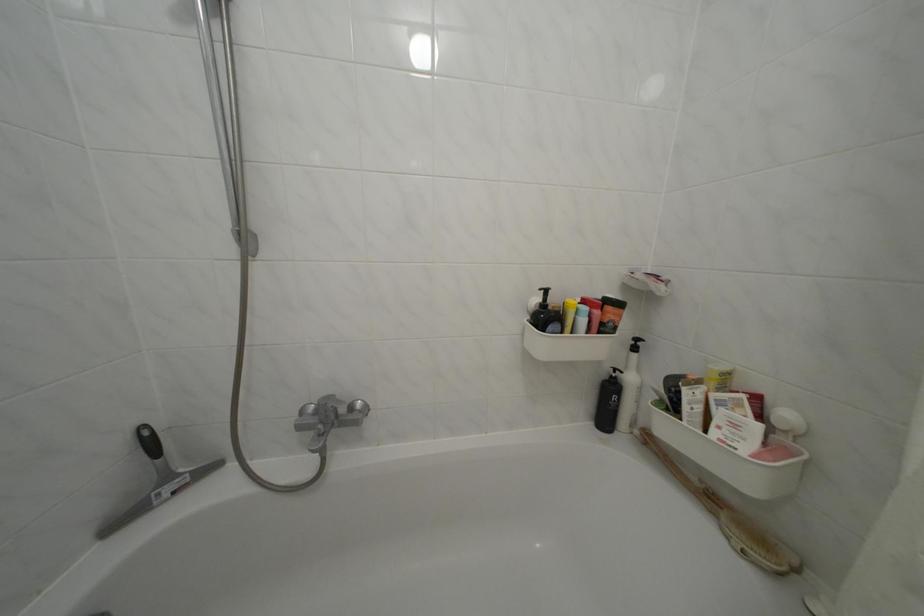
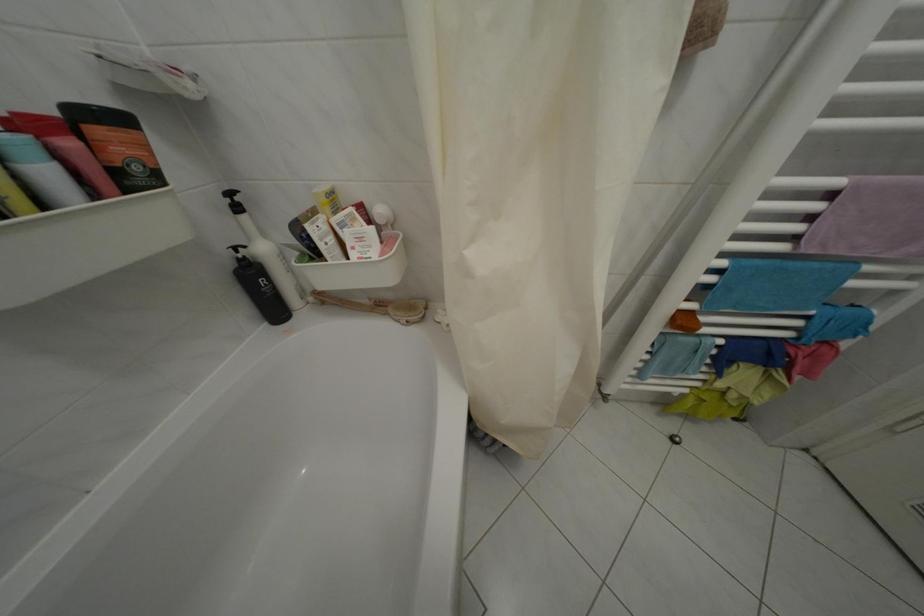
Find the pixel in the second image that matches [623,381] in the first image.

(249, 262)